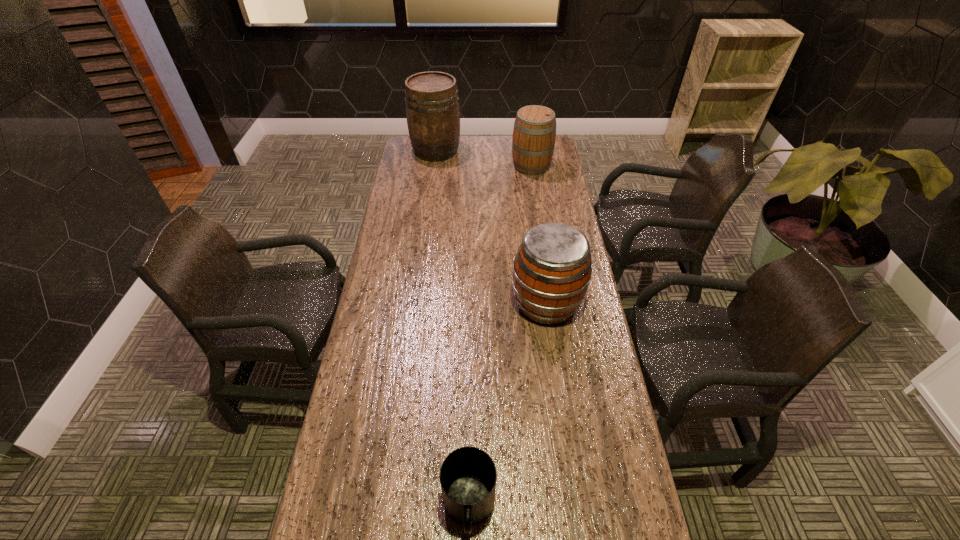
Image resolution: width=960 pixels, height=540 pixels. I want to click on free space at the right edge of the desktop, so click(535, 206).

Locate an element on the screen. This screenshot has width=960, height=540. unoccupied position between the third farthest object and the leftmost cider is located at coordinates (492, 227).

The height and width of the screenshot is (540, 960). I want to click on vacant point located between the leftmost cider and the nearest cider, so click(492, 227).

What are the coordinates of `free space between the nearest cider and the leftmost cider` in the screenshot? It's located at (492, 227).

Locate an element on the screen. object that ranks as the third closest to the tallest cider is located at coordinates (468, 475).

Point out which object is positioned as the nearest to the third farthest object. Please provide its 2D coordinates. Your answer should be formatted as a tuple, i.e. [(x, y)], where the tuple contains the x and y coordinates of a point satisfying the conditions above.

[(468, 475)]

Locate which cider ranks second in proximity to the third object from right to left. Please provide its 2D coordinates. Your answer should be formatted as a tuple, i.e. [(x, y)], where the tuple contains the x and y coordinates of a point satisfying the conditions above.

[(534, 133)]

You are a GUI agent. You are given a task and a screenshot of the screen. Output one action in this format:
    pyautogui.click(x=<x>, y=<y>)
    Task: Click on the cider that is the closest one to the leftmost cider
    The image size is (960, 540).
    Given the screenshot: What is the action you would take?
    pyautogui.click(x=534, y=133)

At what (x,y) coordinates should I click in order to perform the action: click on vacant space that satisfies the following two spatial constraints: 1. on the side of the third farthest object near the bung hole; 2. on the left side of the tallest cider. Please return your answer as a coordinate pair (x, y). Looking at the image, I should click on (416, 303).

Find the location of `vacant position in the image that satisfies the following two spatial constraints: 1. on the side of the nearest cider near the bung hole; 2. on the right side of the tallest cider`. vacant position in the image that satisfies the following two spatial constraints: 1. on the side of the nearest cider near the bung hole; 2. on the right side of the tallest cider is located at coordinates (416, 303).